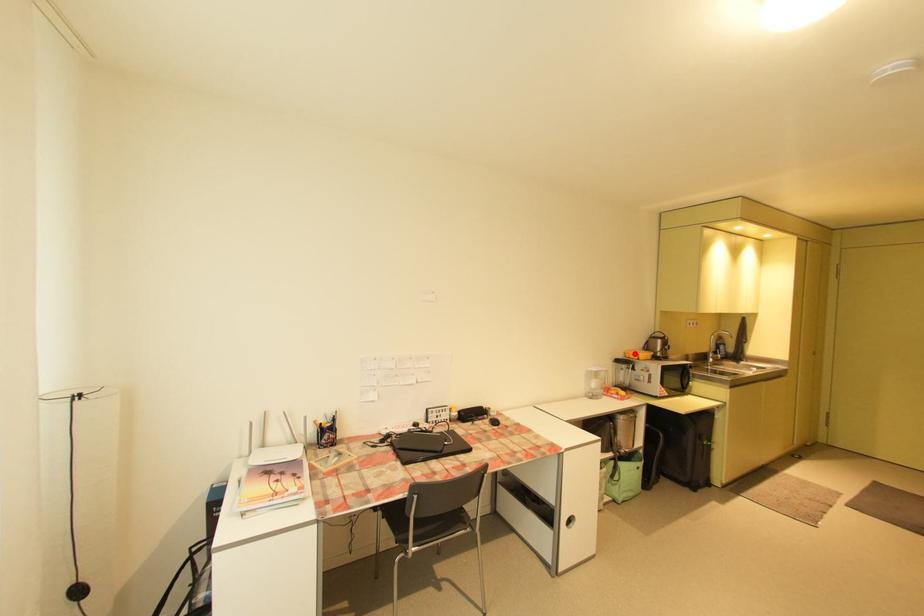
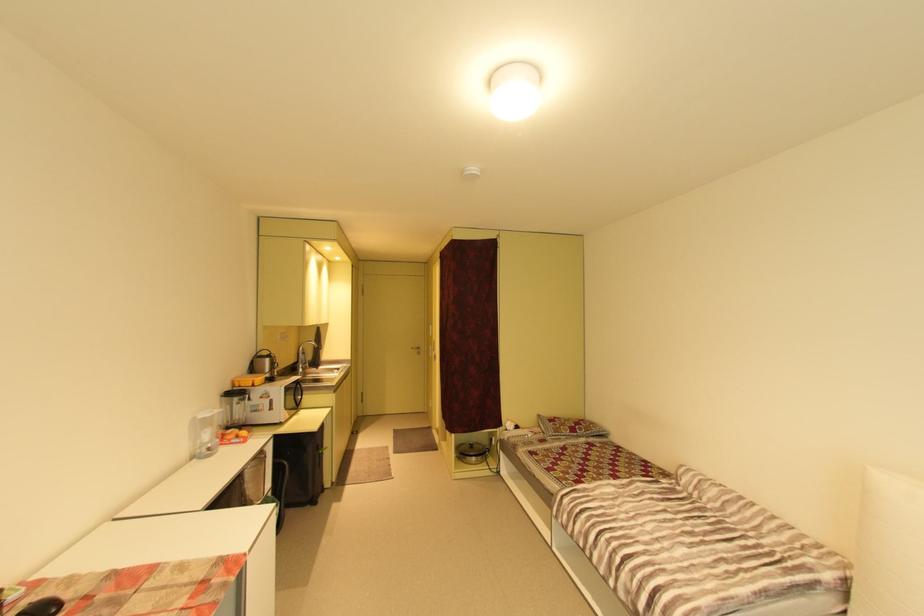
In the second image, find the point that corresponds to the highlighted location in the first image.

(246, 381)